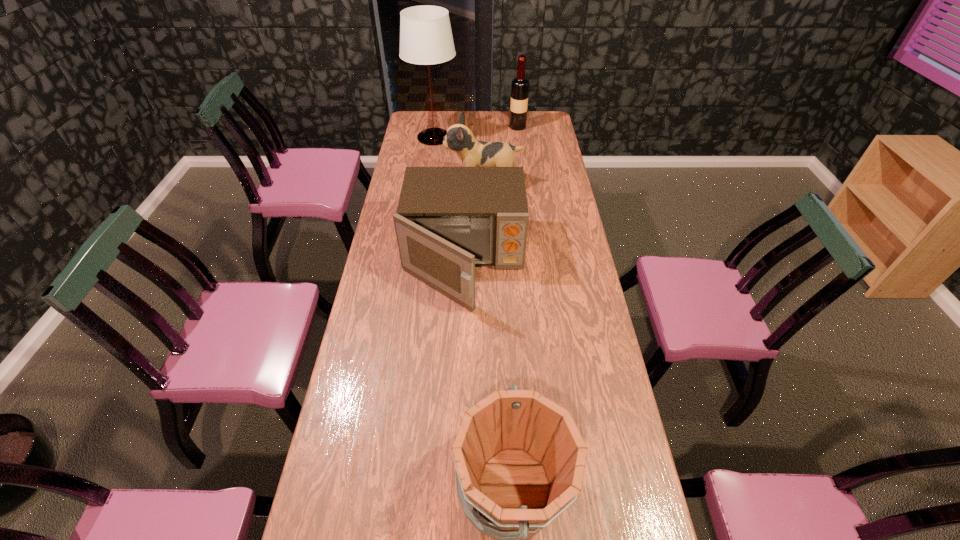
Find the location of `vacant space situated with the door open on the front of the microwave oven`. vacant space situated with the door open on the front of the microwave oven is located at coordinates (460, 353).

Identify the location of table lamp that is positioned at the far edge. The width and height of the screenshot is (960, 540). (426, 38).

Locate an element on the screen. wine bottle that is at the far edge is located at coordinates (520, 86).

Locate an element on the screen. table lamp that is at the left edge is located at coordinates (426, 38).

The width and height of the screenshot is (960, 540). Identify the location of microwave oven present at the left edge. (449, 219).

What are the coordinates of `object that is positioned at the right edge` in the screenshot? It's located at (520, 86).

In order to click on object that is at the far left corner in this screenshot , I will do `click(426, 38)`.

Where is `object present at the far right corner`? Image resolution: width=960 pixels, height=540 pixels. object present at the far right corner is located at coordinates (520, 86).

The image size is (960, 540). Find the location of `vacant space at the far edge`. vacant space at the far edge is located at coordinates pyautogui.click(x=449, y=125).

The height and width of the screenshot is (540, 960). What are the coordinates of `free region at the left edge of the desktop` in the screenshot? It's located at (420, 148).